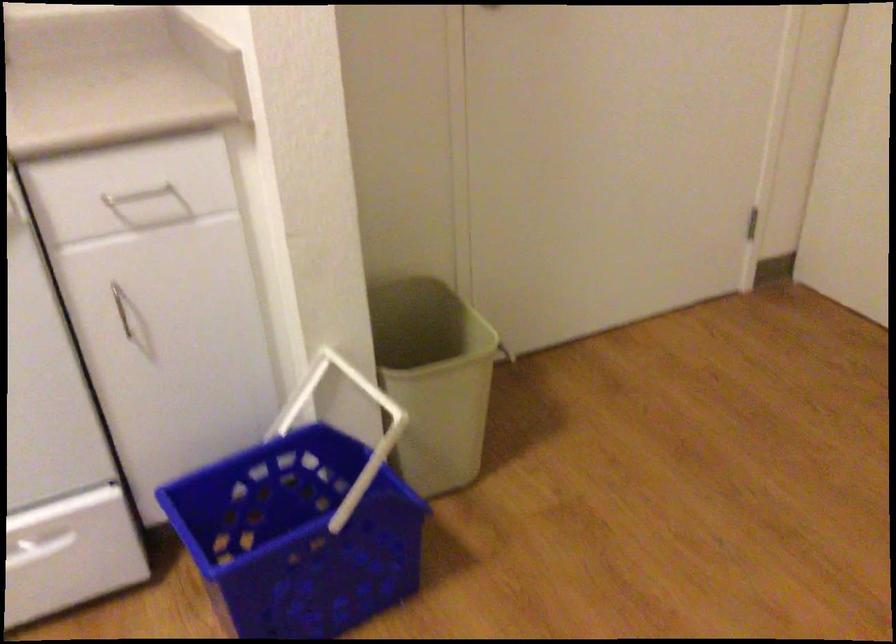
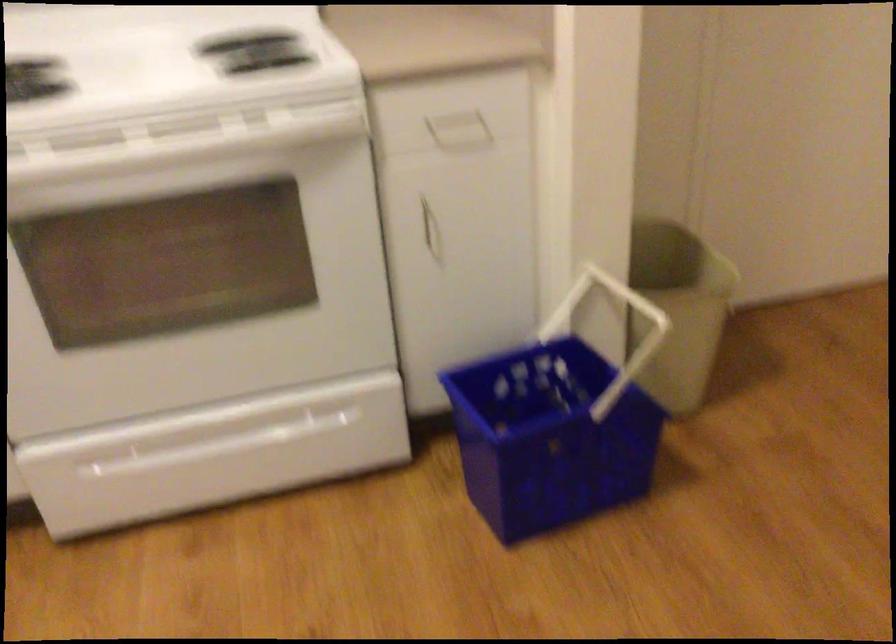
Locate, in the second image, the point that corresponds to (x=140, y=330) in the first image.

(431, 234)